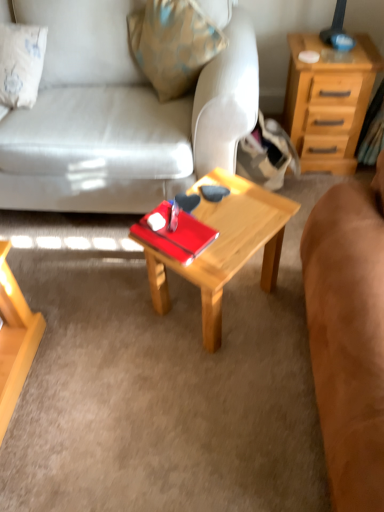
Question: From a real-world perspective, is wooden coffee table at center physically above brown suede couch at center, which is the 2th studio couch in left-to-right order?

Choices:
 (A) no
 (B) yes

Answer: (A)

Question: Is wooden coffee table at center facing away from brown suede couch at center, which is the 2th studio couch in left-to-right order?

Choices:
 (A) yes
 (B) no

Answer: (B)

Question: Is wooden coffee table at center positioned before brown suede couch at center, which is the 2th studio couch in left-to-right order?

Choices:
 (A) no
 (B) yes

Answer: (A)

Question: Does wooden coffee table at center have a greater width compared to brown suede couch at center, which appears as the first studio couch when viewed from the right?

Choices:
 (A) yes
 (B) no

Answer: (A)

Question: From the image's perspective, does wooden coffee table at center appear lower than brown suede couch at center, which is the 2th studio couch in left-to-right order?

Choices:
 (A) yes
 (B) no

Answer: (B)

Question: From a real-world perspective, is wooden coffee table at center below brown suede couch at center, which is the 2th studio couch in left-to-right order?

Choices:
 (A) no
 (B) yes

Answer: (B)

Question: Is light brown wood nightstand at upper right oriented towards wooden coffee table at center?

Choices:
 (A) yes
 (B) no

Answer: (B)

Question: Is light brown wood nightstand at upper right shorter than wooden coffee table at center?

Choices:
 (A) no
 (B) yes

Answer: (A)

Question: Is light brown wood nightstand at upper right further to the viewer compared to wooden coffee table at center?

Choices:
 (A) no
 (B) yes

Answer: (B)

Question: Is the surface of light brown wood nightstand at upper right in direct contact with wooden coffee table at center?

Choices:
 (A) yes
 (B) no

Answer: (B)

Question: Considering the relative positions of light brown wood nightstand at upper right and wooden coffee table at center in the image provided, is light brown wood nightstand at upper right to the right of wooden coffee table at center from the viewer's perspective?

Choices:
 (A) no
 (B) yes

Answer: (B)

Question: From the image's perspective, is light brown wood nightstand at upper right located beneath wooden coffee table at center?

Choices:
 (A) no
 (B) yes

Answer: (A)

Question: From a real-world perspective, is wooden coffee table at center located beneath matte white couch at center, the second studio couch in the right-to-left sequence?

Choices:
 (A) yes
 (B) no

Answer: (A)